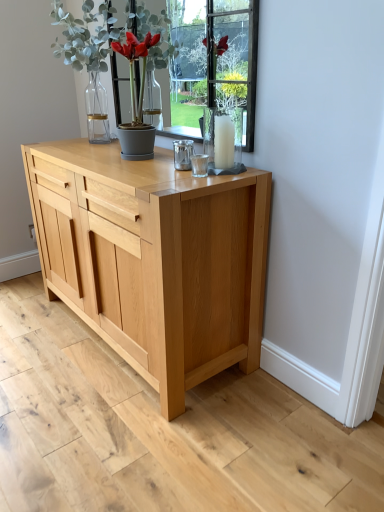
Question: Does green matte plant at upper center have a lesser width compared to clear glass candle at center?

Choices:
 (A) no
 (B) yes

Answer: (A)

Question: Considering the relative sizes of green matte plant at upper center and clear glass candle at center in the image provided, is green matte plant at upper center taller than clear glass candle at center?

Choices:
 (A) no
 (B) yes

Answer: (B)

Question: Would you say green matte plant at upper center is a long distance from clear glass candle at center?

Choices:
 (A) no
 (B) yes

Answer: (A)

Question: Is clear glass candle at center a part of green matte plant at upper center?

Choices:
 (A) no
 (B) yes

Answer: (A)

Question: Considering the relative positions of green matte plant at upper center and clear glass candle at center in the image provided, is green matte plant at upper center to the right of clear glass candle at center from the viewer's perspective?

Choices:
 (A) yes
 (B) no

Answer: (B)

Question: Does green matte plant at upper center have a larger size compared to clear glass candle at center?

Choices:
 (A) yes
 (B) no

Answer: (A)

Question: Does natural wood chest of drawers at center lie in front of clear glass candle at center?

Choices:
 (A) no
 (B) yes

Answer: (B)

Question: From a real-world perspective, is natural wood chest of drawers at center beneath clear glass candle at center?

Choices:
 (A) no
 (B) yes

Answer: (B)

Question: From a real-world perspective, does natural wood chest of drawers at center stand above clear glass candle at center?

Choices:
 (A) yes
 (B) no

Answer: (B)

Question: Can you confirm if natural wood chest of drawers at center is smaller than clear glass candle at center?

Choices:
 (A) no
 (B) yes

Answer: (A)

Question: Is natural wood chest of drawers at center behind clear glass candle at center?

Choices:
 (A) yes
 (B) no

Answer: (B)

Question: Is natural wood chest of drawers at center far away from clear glass candle at center?

Choices:
 (A) no
 (B) yes

Answer: (A)

Question: Could you tell me if clear glass candle at center is facing natural wood chest of drawers at center?

Choices:
 (A) no
 (B) yes

Answer: (A)